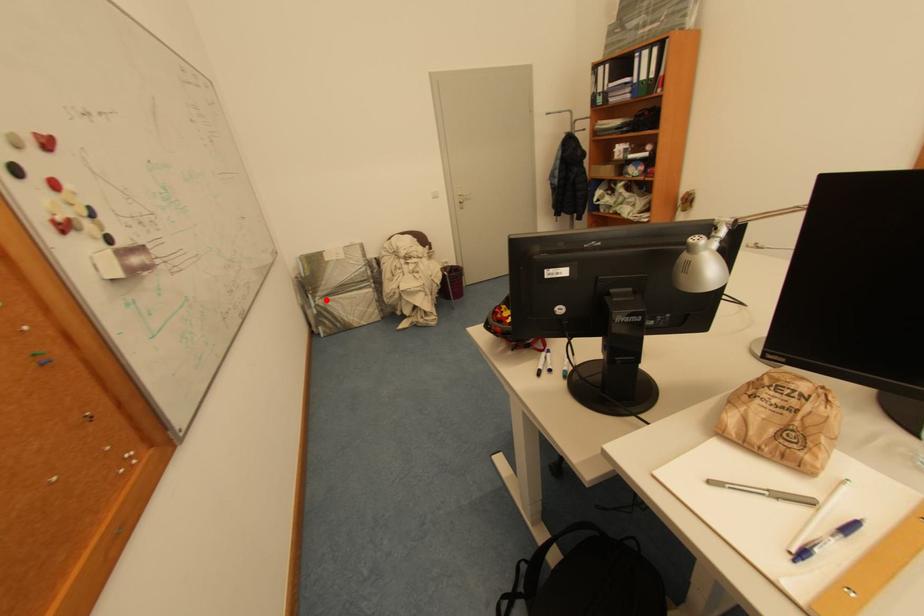
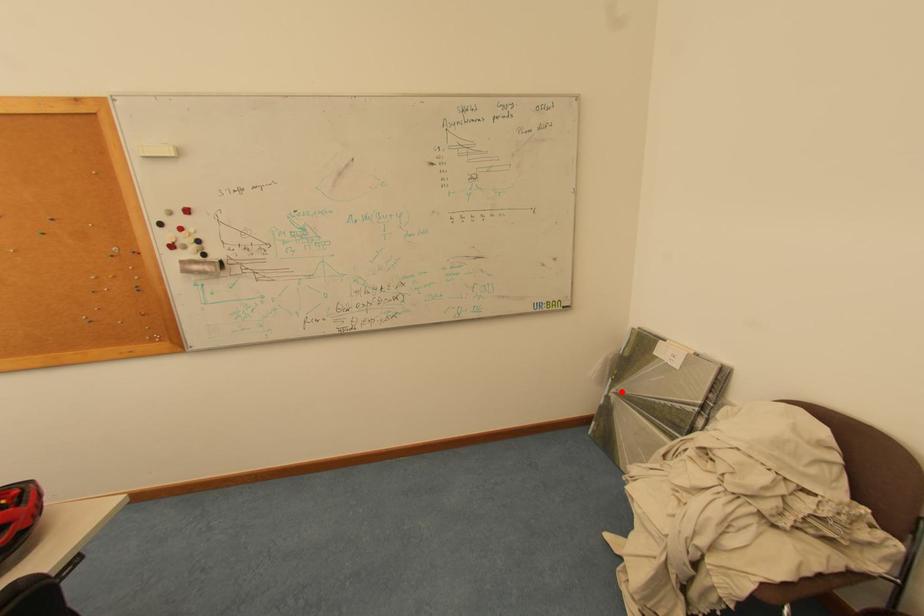
I am providing you with two images of the same scene from different viewpoints. A red point is marked on the first image and another point is marked on the second image. Are the points marked in image1 and image2 representing the same 3D position?

Yes